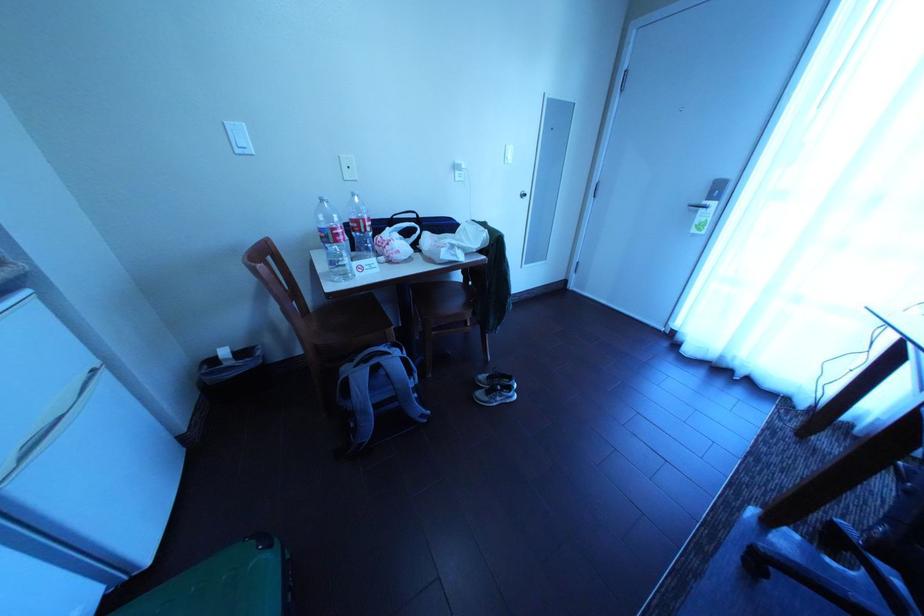
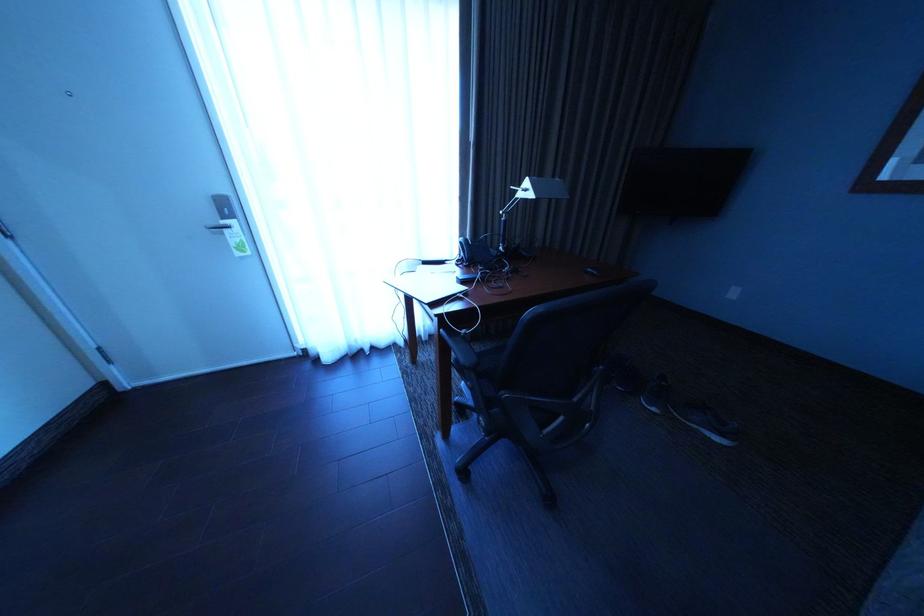
Based on the continuous images, in which direction is the camera rotating?

The rotation direction of the camera is right-down.